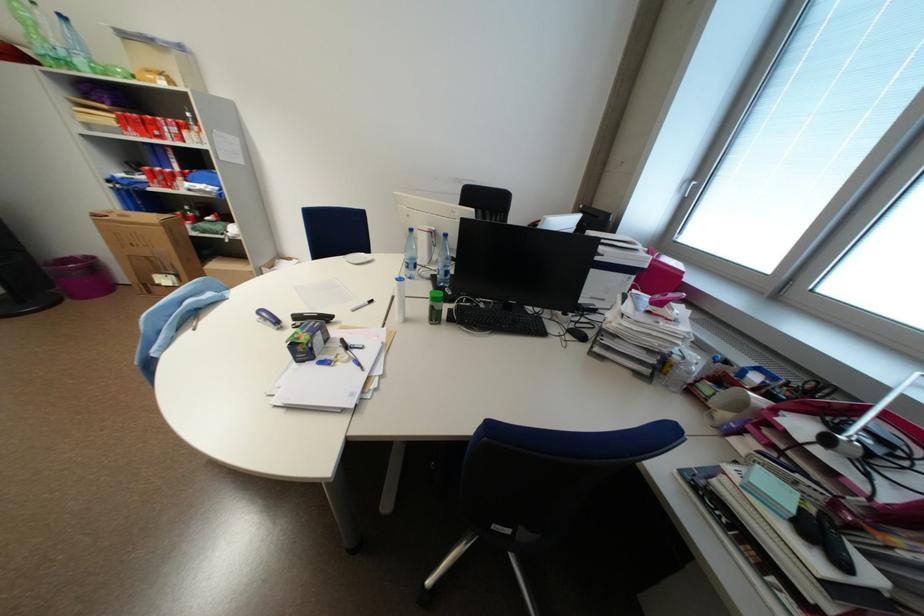
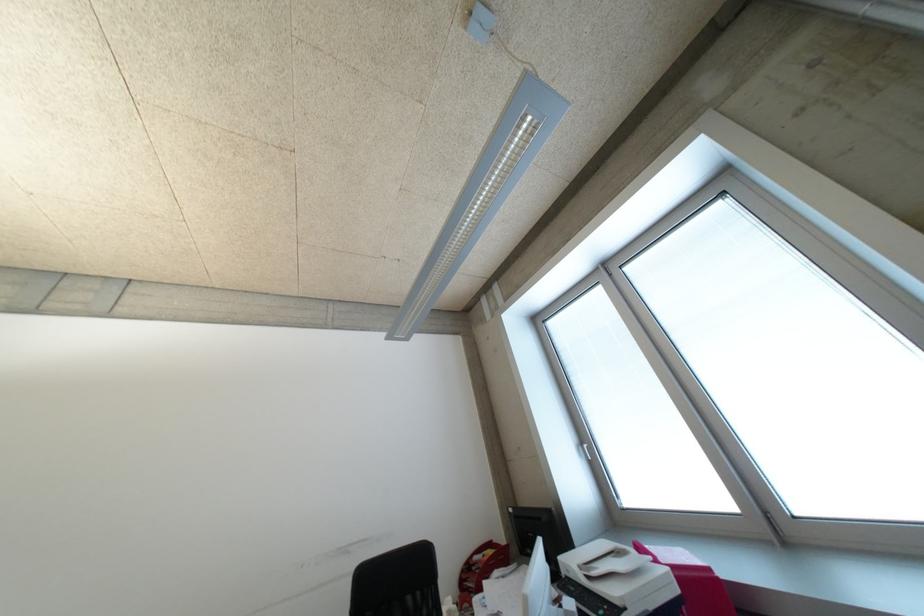
The point at (654, 268) is marked in the first image. Where is the corresponding point in the second image?

(687, 591)